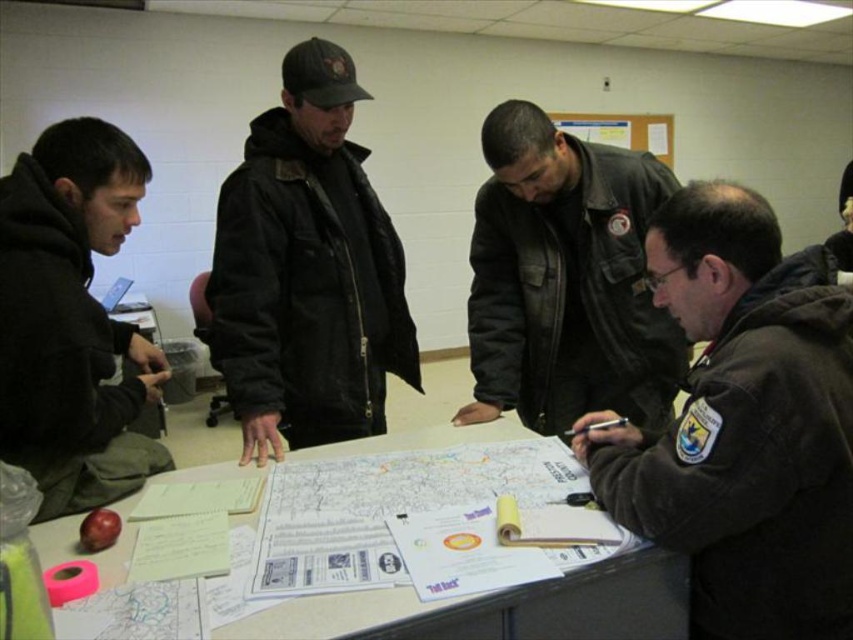
Question: Is matte black jacket at center to the right of black fleece hoodie at left from the viewer's perspective?

Choices:
 (A) yes
 (B) no

Answer: (A)

Question: Which object is the closest to the matte black jacket at center?

Choices:
 (A) leather jacket at center
 (B) black fleece hoodie at left
 (C) dark brown leather jacket at lower right

Answer: (B)

Question: Is leather jacket at center below white paper at center?

Choices:
 (A) yes
 (B) no

Answer: (B)

Question: Which point is closer to the camera taking this photo?

Choices:
 (A) (830, 468)
 (B) (299, 596)
 (C) (296, 65)

Answer: (B)

Question: Which object is closer to the camera taking this photo?

Choices:
 (A) wooden noticeboard at upper center
 (B) black fleece hoodie at left

Answer: (B)

Question: Where is dark brown leather jacket at lower right located in relation to matte black jacket at center in the image?

Choices:
 (A) above
 (B) below

Answer: (B)